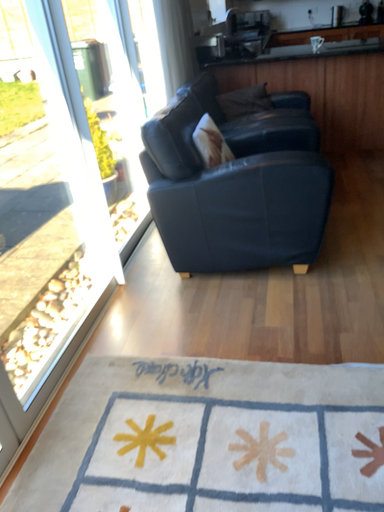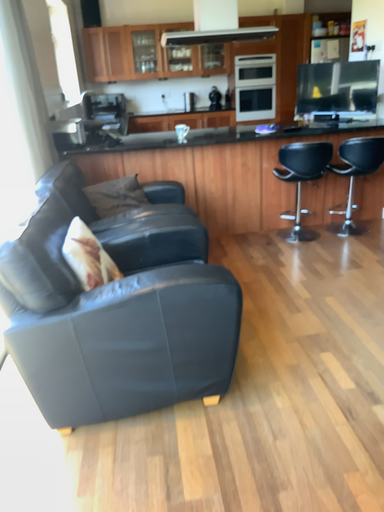
Question: How did the camera likely rotate when shooting the video?

Choices:
 (A) rotated right
 (B) rotated left

Answer: (A)